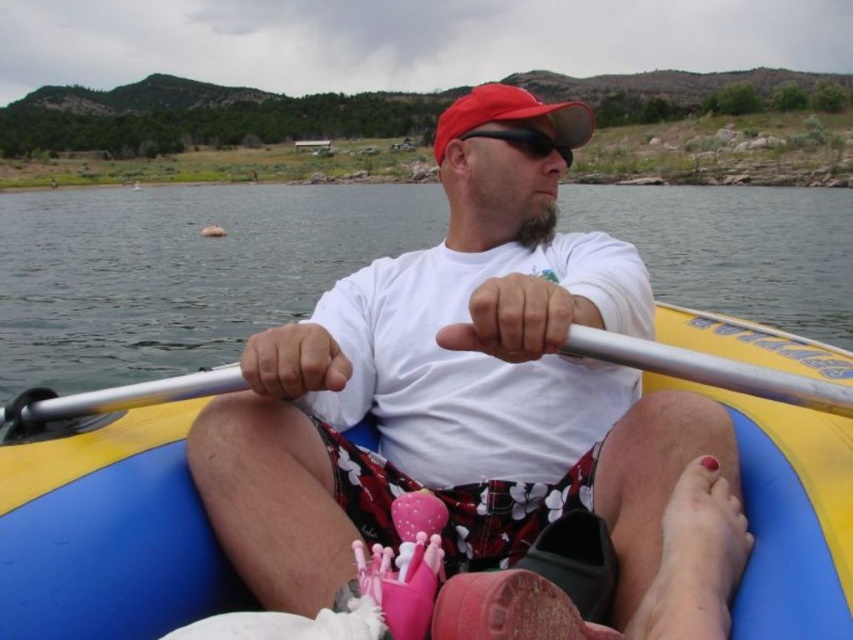
Between transparent water at center and yellow rubber boat at center, which one appears on the right side from the viewer's perspective?

From the viewer's perspective, yellow rubber boat at center appears more on the right side.

Is transparent water at center wider than yellow rubber boat at center?

Correct, the width of transparent water at center exceeds that of yellow rubber boat at center.

Find the location of a particular element. The height and width of the screenshot is (640, 853). transparent water at center is located at coordinates (178, 272).

Does yellow rubber boat at center have a greater height compared to silver metallic paddle at center?

Yes, yellow rubber boat at center is taller than silver metallic paddle at center.

Is yellow rubber boat at center wider than silver metallic paddle at center?

Correct, the width of yellow rubber boat at center exceeds that of silver metallic paddle at center.

Measure the distance between yellow rubber boat at center and camera.

yellow rubber boat at center and camera are 2.10 meters apart.

Locate an element on the screen. This screenshot has width=853, height=640. yellow rubber boat at center is located at coordinates (111, 522).

Can you confirm if white matte t-shirt at center is shorter than transparent water at center?

Correct, white matte t-shirt at center is not as tall as transparent water at center.

Is point (518, 449) positioned in front of point (399, 234)?

Yes, point (518, 449) is closer to viewer.

Which is behind, point (505, 515) or point (722, 291)?

Positioned behind is point (722, 291).

Identify the location of white matte t-shirt at center. (465, 403).